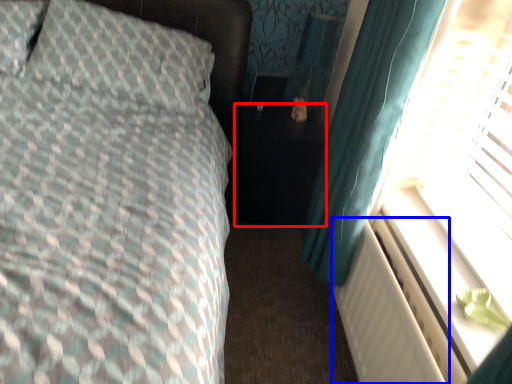
Question: Which of the following is the closest to the observer, side table (highlighted by a red box) or radiator (highlighted by a blue box)?

Choices:
 (A) side table
 (B) radiator

Answer: (B)